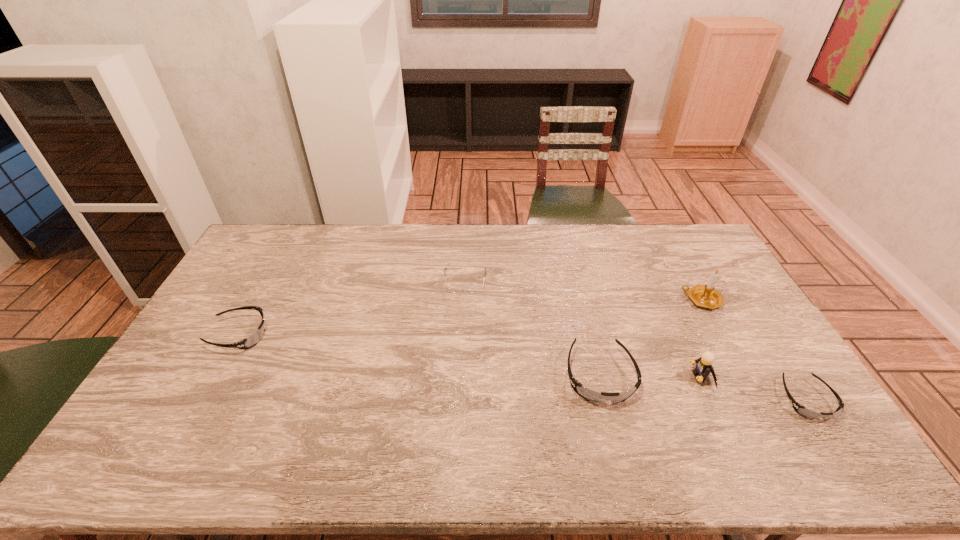
I want to click on sunglasses that stands as the second closest to the tallest sunglasses, so 252,340.

Where is `sunglasses that stands as the third closest to the tallest object`? sunglasses that stands as the third closest to the tallest object is located at coordinates (252, 340).

This screenshot has height=540, width=960. Identify the location of free point that satisfies the following two spatial constraints: 1. on the front side of the candle holder; 2. on the lenses of the second shortest sunglasses. (721, 335).